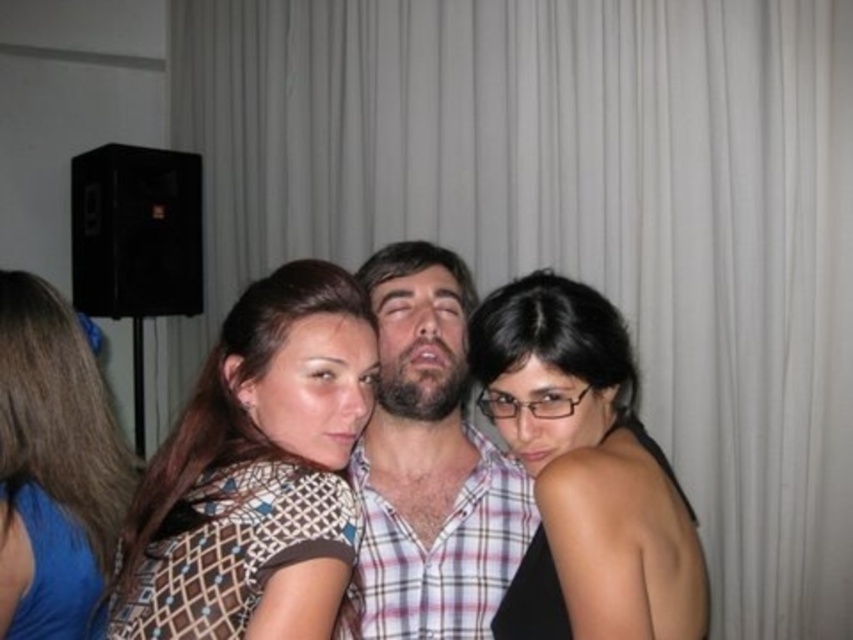
Can you confirm if black matte hair at center is thinner than matte brown dress at left?

Incorrect, black matte hair at center's width is not less than matte brown dress at left's.

Between black matte hair at center and matte brown dress at left, which one appears on the left side from the viewer's perspective?

Positioned to the left is matte brown dress at left.

Is point (693, 556) closer to viewer compared to point (10, 456)?

Yes, it is in front of point (10, 456).

Where is `black matte hair at center`? The width and height of the screenshot is (853, 640). black matte hair at center is located at coordinates (584, 470).

Can you confirm if patterned fabric shirt at center is bigger than matte brown dress at left?

No, patterned fabric shirt at center is not bigger than matte brown dress at left.

Can you confirm if patterned fabric shirt at center is shorter than matte brown dress at left?

Yes, patterned fabric shirt at center is shorter than matte brown dress at left.

Which is behind, point (161, 460) or point (68, 337)?

The point (68, 337) is more distant.

The height and width of the screenshot is (640, 853). In order to click on patterned fabric shirt at center in this screenshot , I will do `click(238, 474)`.

Between point (705, 605) and point (383, 531), which one is positioned in front?

Point (705, 605) is in front.

Which of these two, black matte hair at center or plaid fabric shirt at center, stands shorter?

black matte hair at center

Is point (706, 596) behind point (397, 561)?

That is False.

Where is `black matte hair at center`? black matte hair at center is located at coordinates (584, 470).